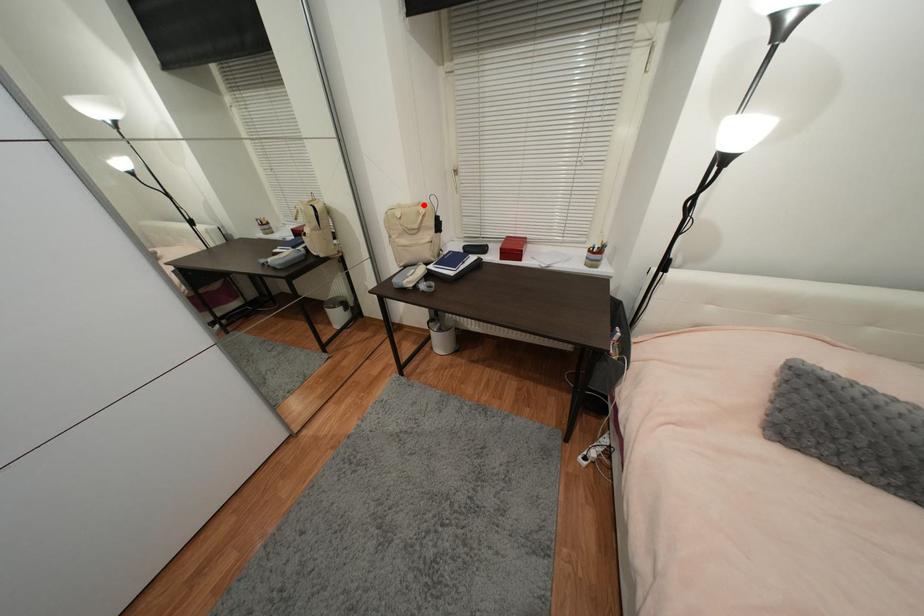
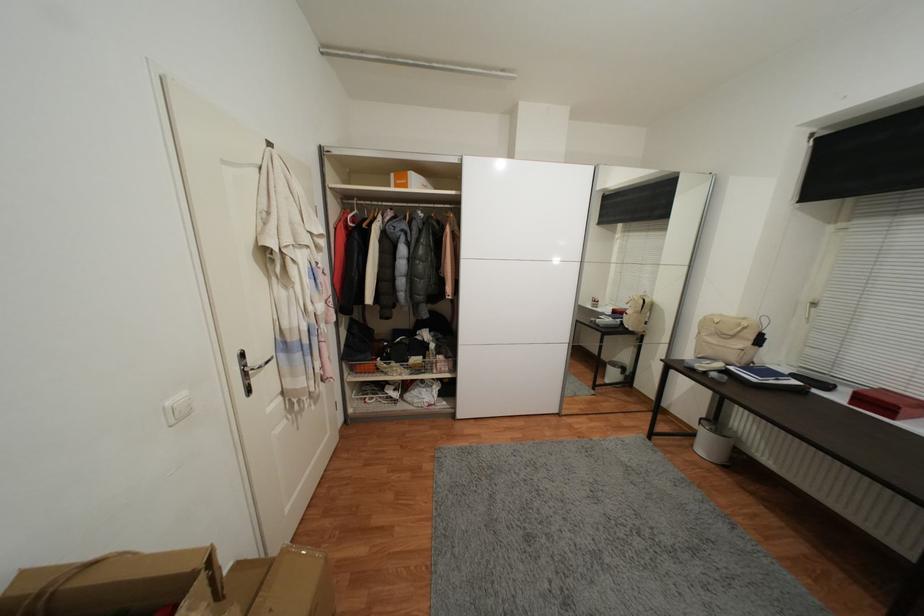
Where in the second image is the point corresponding to the highlighted location from the first image?

(748, 321)